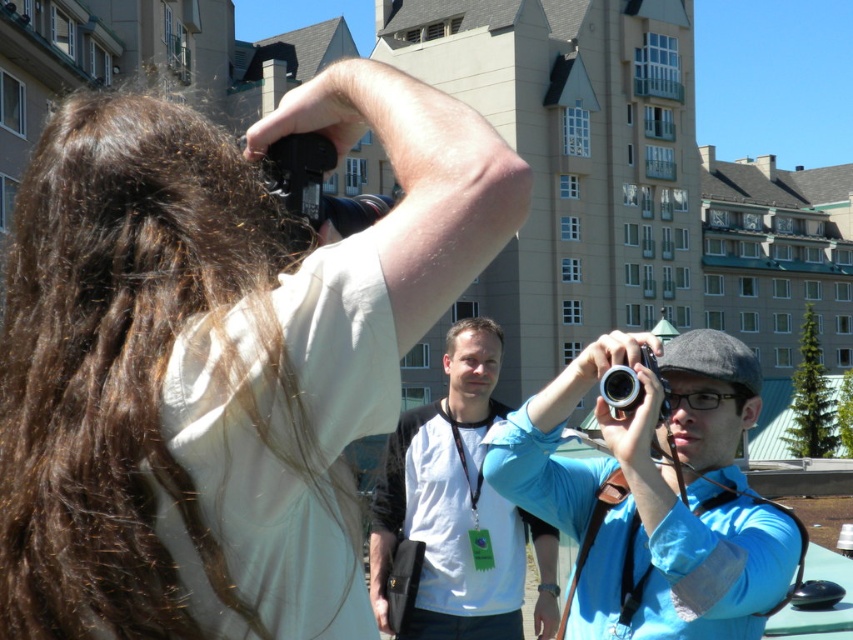
Question: Based on their relative distances, which object is farther from the silver metallic camera at center?

Choices:
 (A) black plastic camera at upper center
 (B) white matte shirt at center
 (C) blue fabric shirt at center

Answer: (B)

Question: In this image, where is matte white shirt at upper left located relative to silver metallic camera at center?

Choices:
 (A) above
 (B) below

Answer: (A)

Question: Estimate the real-world distances between objects in this image. Which object is farther from the matte white shirt at upper left?

Choices:
 (A) white matte shirt at center
 (B) black plastic camera at upper center
 (C) silver metallic camera at center

Answer: (A)

Question: Can you confirm if black plastic camera at upper center is bigger than silver metallic camera at center?

Choices:
 (A) no
 (B) yes

Answer: (B)

Question: Can you confirm if matte white shirt at upper left is wider than white matte shirt at center?

Choices:
 (A) yes
 (B) no

Answer: (A)

Question: Which object is the closest to the blue fabric shirt at center?

Choices:
 (A) white matte shirt at center
 (B) black plastic camera at upper center

Answer: (A)